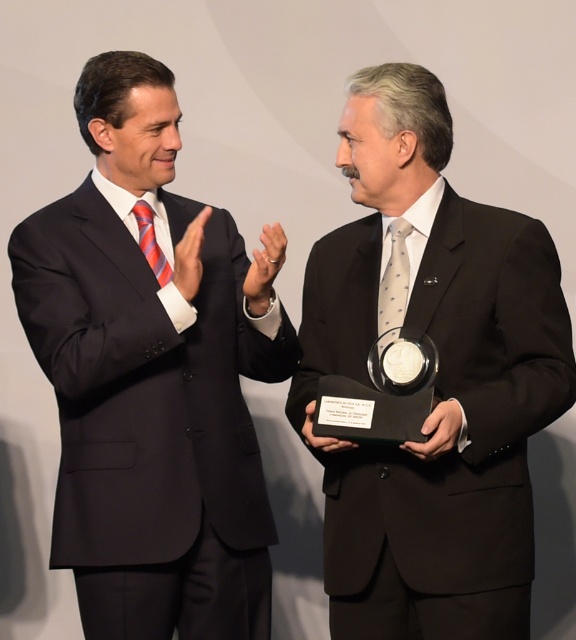
Question: Can you confirm if matte black suit at left is positioned to the left of black matte suit at center?

Choices:
 (A) no
 (B) yes

Answer: (B)

Question: Which point is closer to the camera taking this photo?

Choices:
 (A) (217, 218)
 (B) (411, 276)

Answer: (B)

Question: Is matte black suit at left further to the viewer compared to black matte suit at center?

Choices:
 (A) yes
 (B) no

Answer: (A)

Question: Where is matte black suit at left located in relation to black matte suit at center in the image?

Choices:
 (A) above
 (B) below

Answer: (B)

Question: Which object is farther from the camera taking this photo?

Choices:
 (A) matte black suit at left
 (B) black matte suit at center

Answer: (A)